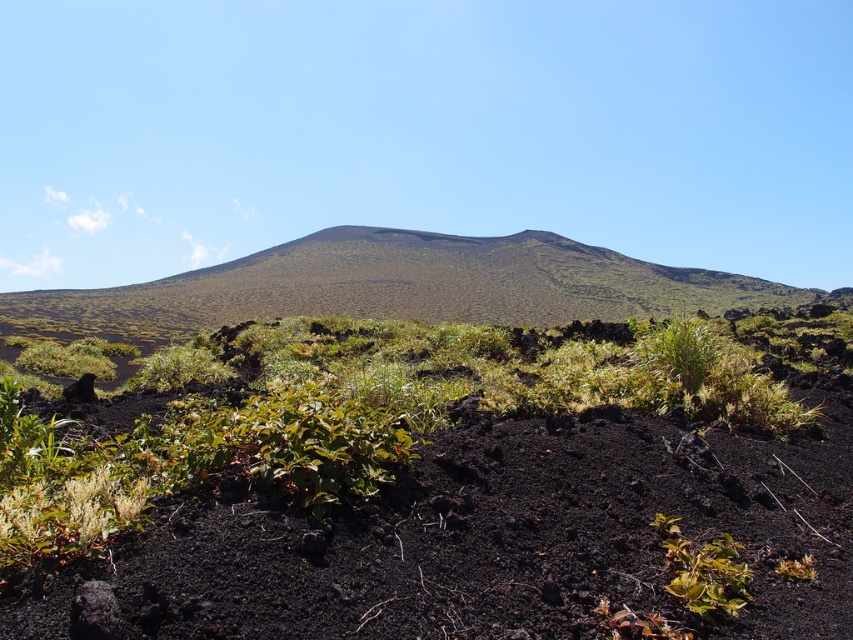
How distant is green shrubs at center from green grassy hillside at center?

green shrubs at center is 37.99 meters from green grassy hillside at center.

Which is behind, point (509, 492) or point (453, 244)?

The point (453, 244) is behind.

Between point (659, 376) and point (683, 289), which one is positioned behind?

Point (683, 289)

The height and width of the screenshot is (640, 853). Find the location of `green shrubs at center`. green shrubs at center is located at coordinates (434, 490).